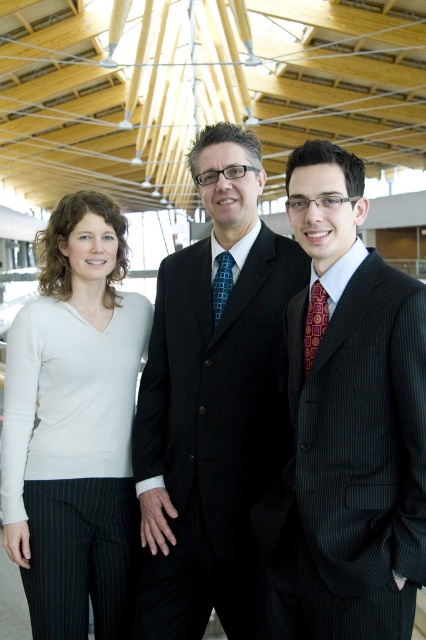
Question: Which object is the farthest from the black pinstripe suit at center?

Choices:
 (A) white matte sweater at left
 (B) dark pinstripe suit at center

Answer: (B)

Question: Does black pinstripe suit at center appear under white matte sweater at left?

Choices:
 (A) yes
 (B) no

Answer: (B)

Question: Does dark pinstripe suit at center have a lesser width compared to white matte sweater at left?

Choices:
 (A) yes
 (B) no

Answer: (A)

Question: Is dark pinstripe suit at center smaller than black pinstripe suit at center?

Choices:
 (A) yes
 (B) no

Answer: (A)

Question: Which object is positioned closest to the dark pinstripe suit at center?

Choices:
 (A) black pinstripe suit at center
 (B) white matte sweater at left

Answer: (A)

Question: Estimate the real-world distances between objects in this image. Which object is closer to the dark pinstripe suit at center?

Choices:
 (A) black pinstripe suit at center
 (B) white matte sweater at left

Answer: (A)